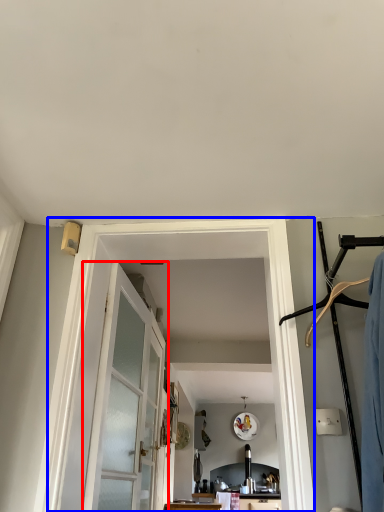
Question: Which object is further to the camera taking this photo, door (highlighted by a red box) or barn door (highlighted by a blue box)?

Choices:
 (A) door
 (B) barn door

Answer: (A)